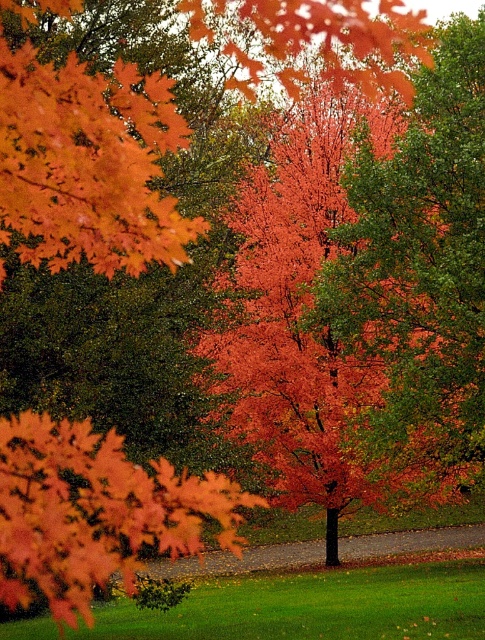
Is shiny orange maple leaf at upper left shorter than shiny orange maple at center?

Indeed, shiny orange maple leaf at upper left has a lesser height compared to shiny orange maple at center.

Between shiny orange maple leaf at upper left and shiny orange maple at center, which one appears on the left side from the viewer's perspective?

shiny orange maple at center is more to the left.

What do you see at coordinates (87, 164) in the screenshot?
I see `shiny orange maple leaf at upper left` at bounding box center [87, 164].

The height and width of the screenshot is (640, 485). Identify the location of shiny orange maple leaf at upper left. [x=87, y=164].